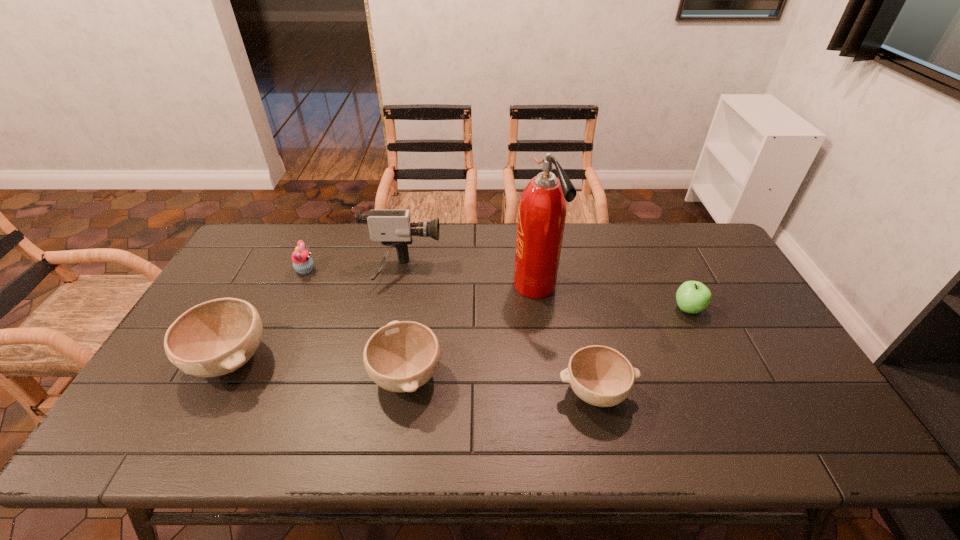
In the image, there is a desktop. Where is `vacant space at the near edge`? This screenshot has height=540, width=960. vacant space at the near edge is located at coordinates pos(499,386).

I want to click on vacant point at the right edge, so click(x=756, y=307).

Where is `free point at the far left corner`? The image size is (960, 540). free point at the far left corner is located at coordinates (263, 261).

The width and height of the screenshot is (960, 540). In the image, there is a desktop. What are the coordinates of `vacant space at the near left corner` in the screenshot? It's located at (172, 384).

Find the location of a particular element. unoccupied position between the shortest bowl and the cupcake is located at coordinates (450, 331).

I want to click on empty location between the shortest bowl and the apple, so click(641, 350).

Image resolution: width=960 pixels, height=540 pixels. I want to click on free area in between the rightmost object and the rightmost bowl, so click(641, 350).

Locate an element on the screen. vacant space that is in between the camcorder and the cupcake is located at coordinates (353, 271).

Where is `blank region between the fire extinguisher and the second shortest bowl`? Image resolution: width=960 pixels, height=540 pixels. blank region between the fire extinguisher and the second shortest bowl is located at coordinates (470, 331).

At what (x,y) coordinates should I click in order to perform the action: click on free spot between the second tallest bowl and the leftmost bowl. Please return your answer as a coordinate pair (x, y). Looking at the image, I should click on (319, 367).